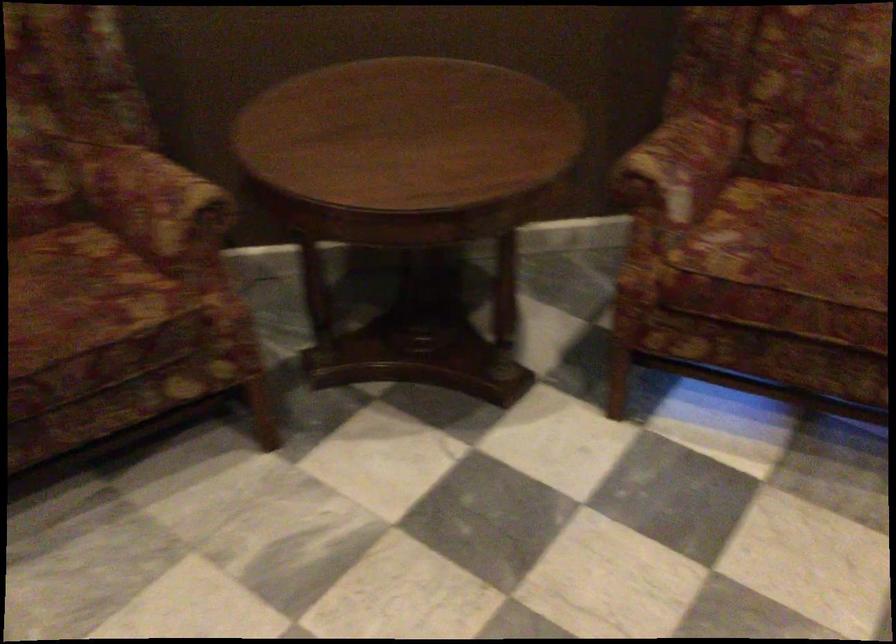
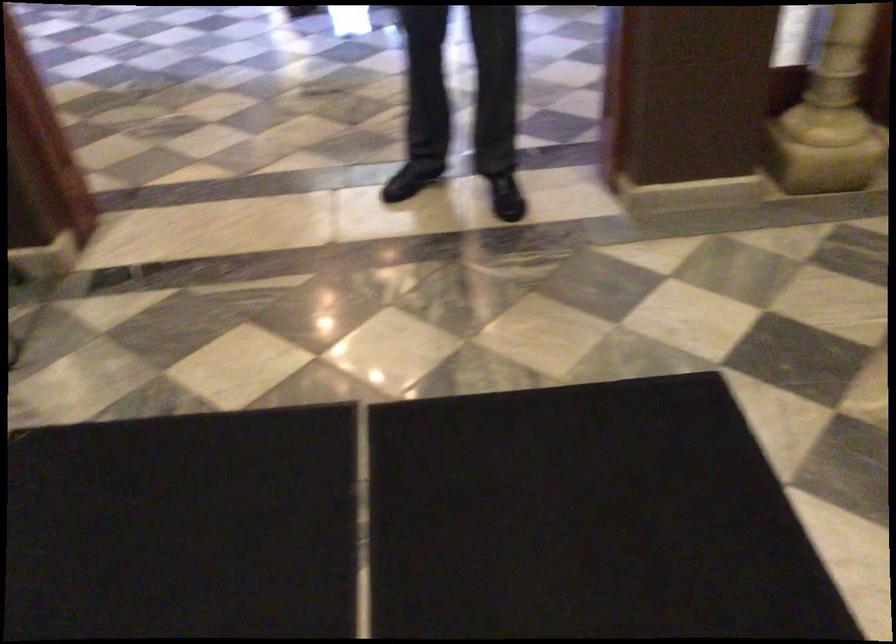
The images are taken continuously from a first-person perspective. In which direction is your viewpoint rotating?

The rotation direction of the camera is left-down.